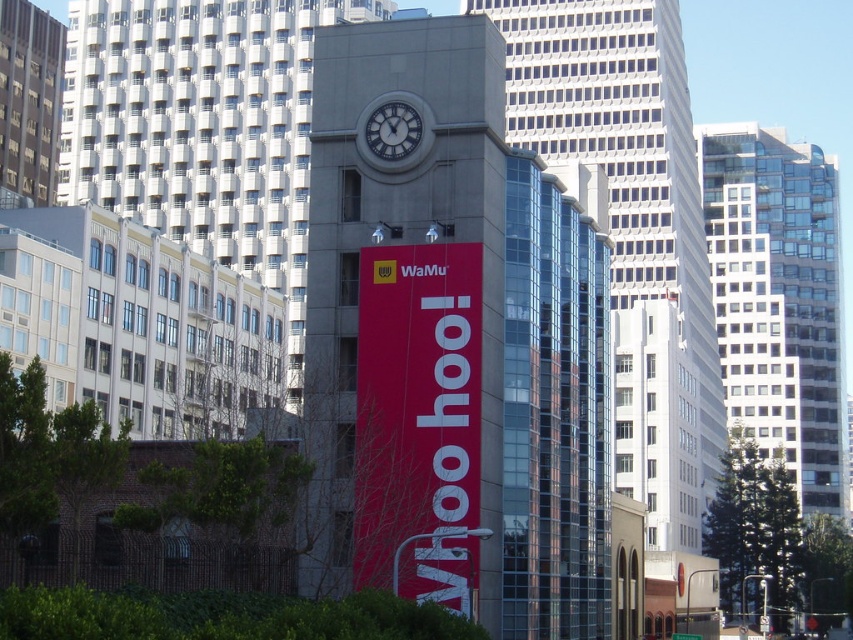
You are standing in front of the building and want to locate the clock tower. Which side of the white textured building at center should you look towards to find the concrete clock tower at center?

The concrete clock tower at center is located to the right of the white textured building at center, so you should look towards the right side of the white textured building at center to find it.

You are standing in the middle of the bustling urban scene and notice two structures at the center of the image. The first is the concrete clock tower at center, and the second is the white textured building at center. Based on their positions, which one is situated lower in the image?

The concrete clock tower at center is located below the white textured building at center, so it is situated lower in the image.

You are standing in the bustling urban scene and want to locate the point at coordinates (x=202, y=128). According to the scene description, where would this point be located?

The point at coordinates (x=202, y=128) is on the white textured building at center.